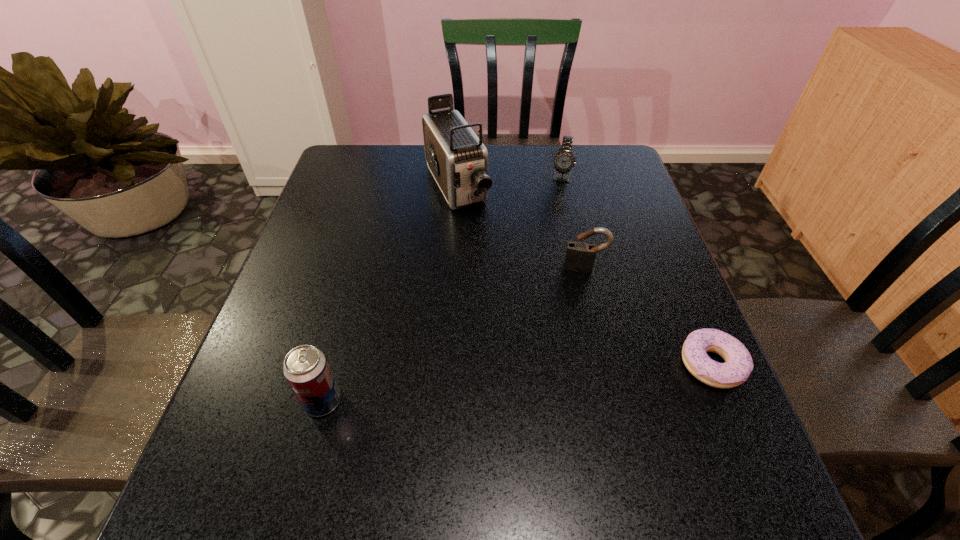
At what (x,y) coordinates should I click in order to perform the action: click on vacant area that lies between the third farthest object and the watch. Please return your answer as a coordinate pair (x, y). Image resolution: width=960 pixels, height=540 pixels. Looking at the image, I should click on (572, 222).

Image resolution: width=960 pixels, height=540 pixels. Identify the location of the closest object to the leftmost object. (458, 160).

Identify which object is located as the third nearest to the doughnut. Please provide its 2D coordinates. Your answer should be formatted as a tuple, i.e. [(x, y)], where the tuple contains the x and y coordinates of a point satisfying the conditions above.

[(564, 160)]